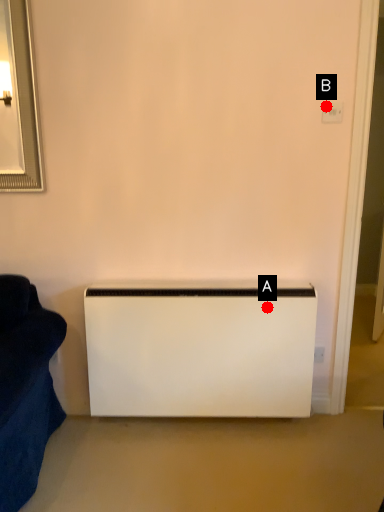
Question: Two points are circled on the image, labeled by A and B beside each circle. Which point is closer to the camera taking this photo?

Choices:
 (A) A is closer
 (B) B is closer

Answer: (B)